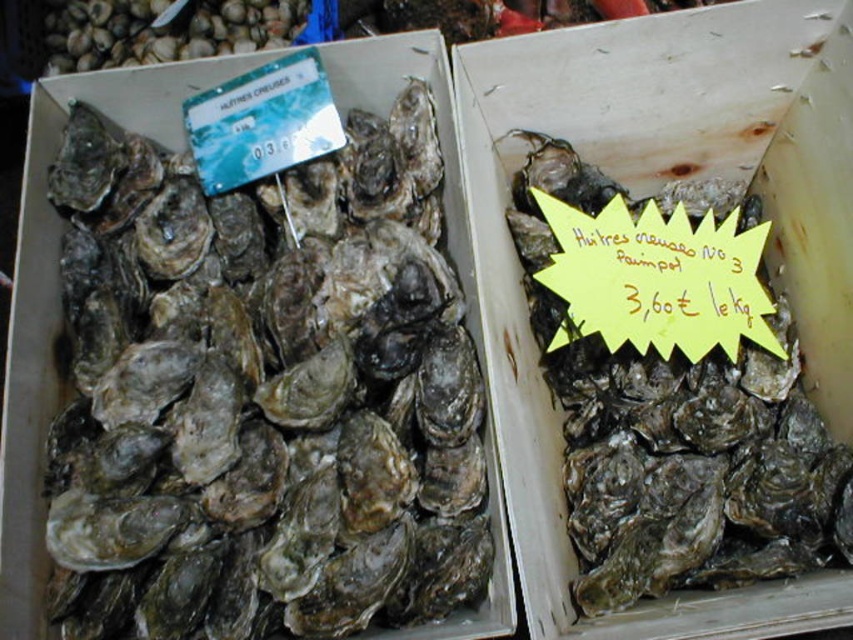
You are a customer at the market and want to compare two oysters. You see the matte gray oyster at left and the dark gray textured oyster at right. Which one is positioned more to the left?

The matte gray oyster at left is positioned more to the left than the dark gray textured oyster at right.

You are a customer at the market and want to pick up the matte gray oyster at left. Will you need to move the dark gray textured oyster at right first?

The matte gray oyster at left is in front of the dark gray textured oyster at right, so you can pick up the matte gray oyster at left without moving the dark gray textured oyster at right.